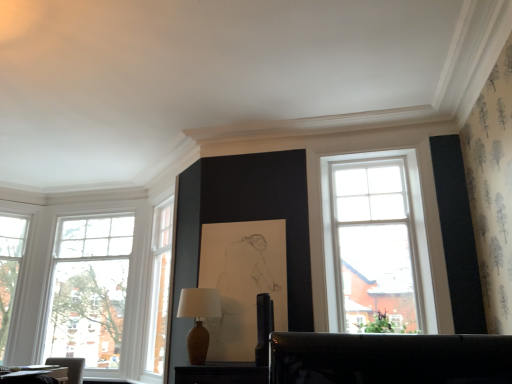
Question: Considering their positions, is clear glass window at left, the first window viewed from the right, located in front of or behind matte brown vase at center?

Choices:
 (A) front
 (B) behind

Answer: (B)

Question: In terms of size, does clear glass window at left, placed as the second window when sorted from left to right, appear bigger or smaller than matte brown vase at center?

Choices:
 (A) small
 (B) big

Answer: (B)

Question: Which of these objects is positioned closest to the white glass window at left, which is the 2th window from right to left?

Choices:
 (A) clear glass window at left, the first window viewed from the right
 (B) matte brown vase at center
 (C) wooden table at lower left

Answer: (A)

Question: Which is nearer to the matte brown vase at center?

Choices:
 (A) wooden table at lower left
 (B) white glass window at left, marked as the 1th window in a left-to-right arrangement
 (C) clear glass window at left, the first window viewed from the right

Answer: (A)